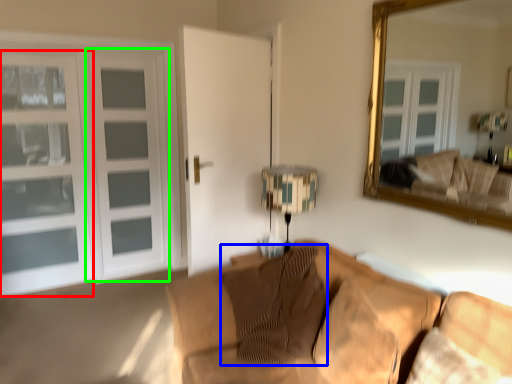
Question: Based on their relative distances, which object is nearer to window (highlighted by a red box)? Choose from pillow (highlighted by a blue box) and screen door (highlighted by a green box).

Choices:
 (A) pillow
 (B) screen door

Answer: (B)